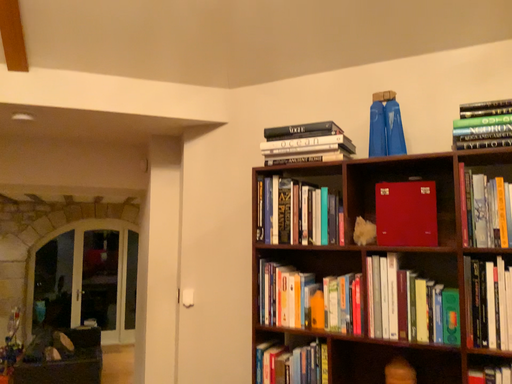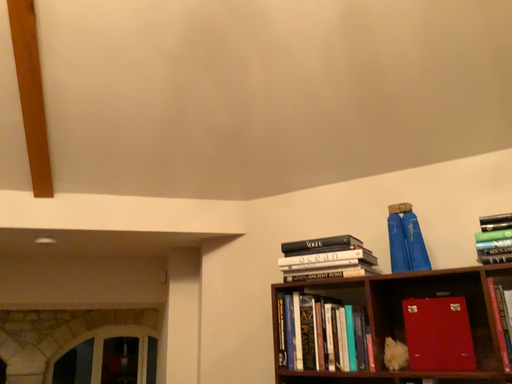
Question: Which way did the camera rotate in the video?

Choices:
 (A) rotated downward
 (B) rotated upward

Answer: (B)